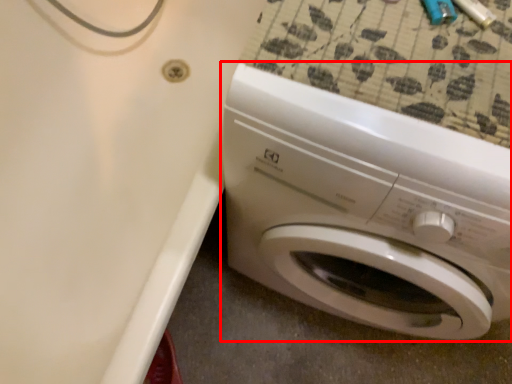
Question: From the image's perspective, where is washing machine (annotated by the red box) located in relation to bath in the image?

Choices:
 (A) below
 (B) above

Answer: (A)